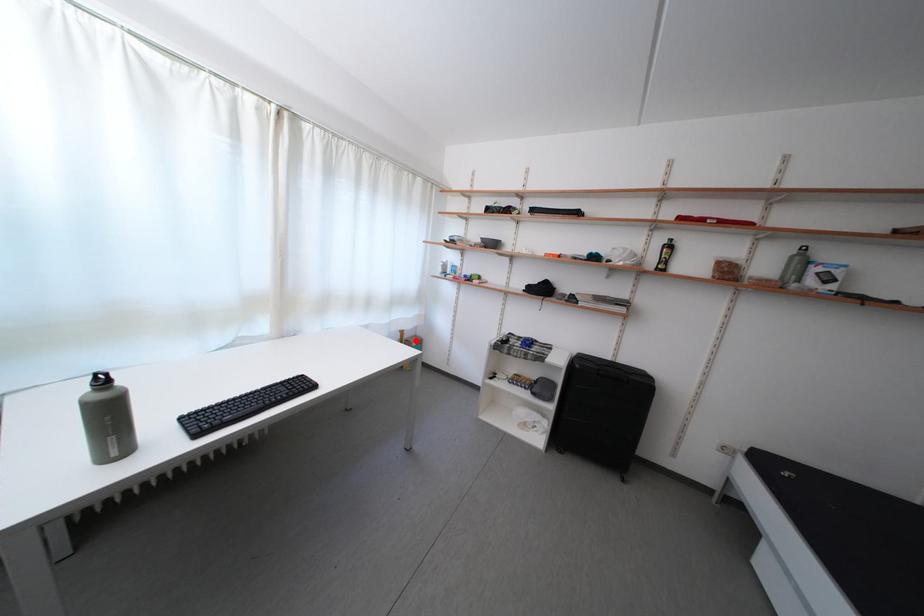
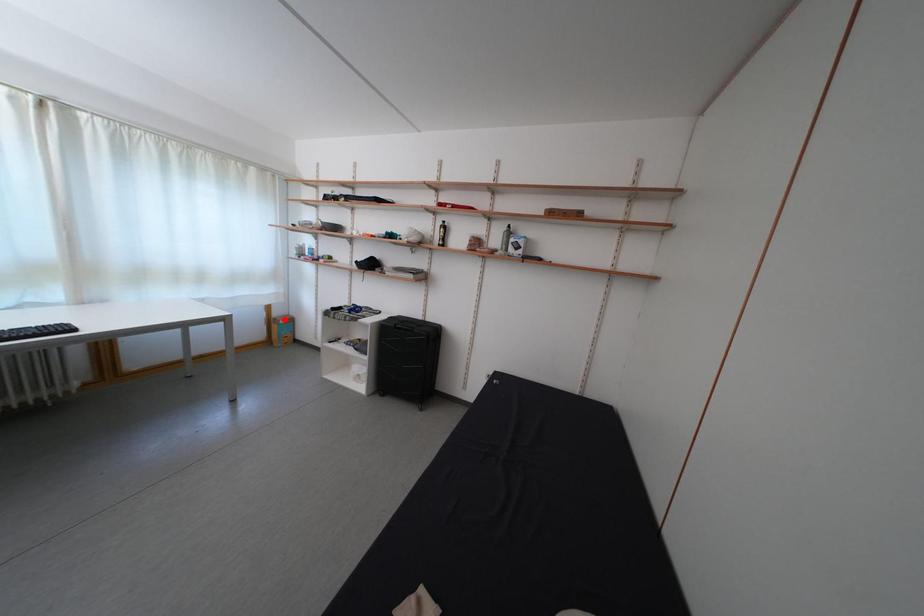
I am providing you with two images of the same scene from different viewpoints. A red point is marked on the first image and another point is marked on the second image. Is the red point in image1 aligned with the point shown in image2?

Yes